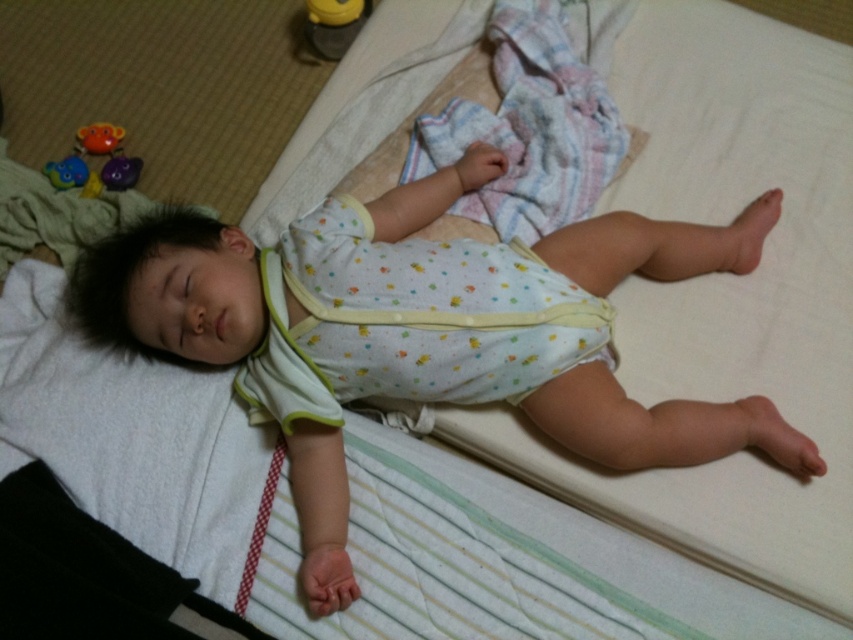
Does white dotted fabric diaper at center come in front of matte plastic toys at upper left?

Yes, it is in front of matte plastic toys at upper left.

Describe the element at coordinates (421, 314) in the screenshot. I see `white dotted fabric diaper at center` at that location.

You are a GUI agent. You are given a task and a screenshot of the screen. Output one action in this format:
    pyautogui.click(x=<x>, y=<y>)
    Task: Click on the white dotted fabric diaper at center
    
    Given the screenshot: What is the action you would take?
    pyautogui.click(x=421, y=314)